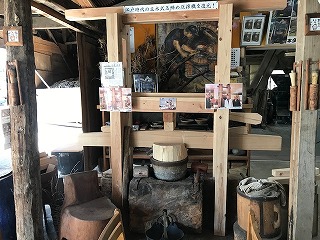
Image resolution: width=320 pixels, height=240 pixels. I want to click on wooden shelf, so click(x=168, y=15), click(x=186, y=103), click(x=189, y=141).